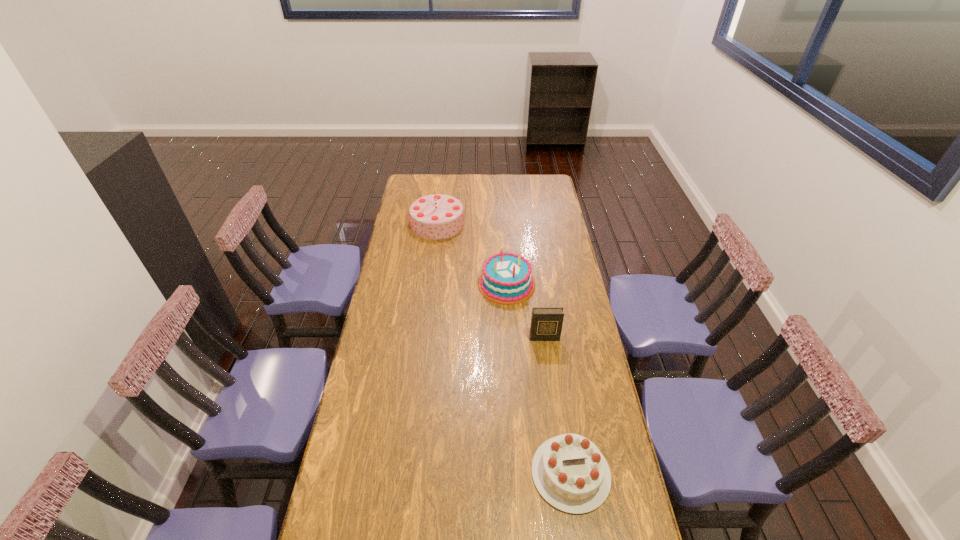
Where is `free space between the tallest object and the nearest birthday cake`? free space between the tallest object and the nearest birthday cake is located at coordinates (504, 348).

The width and height of the screenshot is (960, 540). I want to click on vacant area between the diary and the second shortest birthday cake, so click(x=525, y=311).

Image resolution: width=960 pixels, height=540 pixels. In order to click on empty location between the diary and the nearest birthday cake in this screenshot , I will do `click(558, 406)`.

At what (x,y) coordinates should I click in order to perform the action: click on free space between the second tallest birthday cake and the farthest object. Please return your answer as a coordinate pair (x, y). Looking at the image, I should click on (472, 254).

Find the location of a particular element. The width and height of the screenshot is (960, 540). empty location between the second farthest birthday cake and the diary is located at coordinates (525, 311).

Locate an element on the screen. vacant area between the second shortest birthday cake and the second nearest object is located at coordinates (525, 311).

Locate an element on the screen. Image resolution: width=960 pixels, height=540 pixels. vacant area that lies between the second farthest object and the nearest object is located at coordinates (539, 379).

At what (x,y) coordinates should I click in order to perform the action: click on object that is the second closest one to the second tallest birthday cake. Please return your answer as a coordinate pair (x, y). Looking at the image, I should click on (437, 216).

This screenshot has height=540, width=960. What are the coordinates of `object identified as the closest to the second nearest object` in the screenshot? It's located at (506, 279).

Select which birthday cake appears as the second closest to the second tallest birthday cake. Please provide its 2D coordinates. Your answer should be formatted as a tuple, i.e. [(x, y)], where the tuple contains the x and y coordinates of a point satisfying the conditions above.

[(571, 474)]